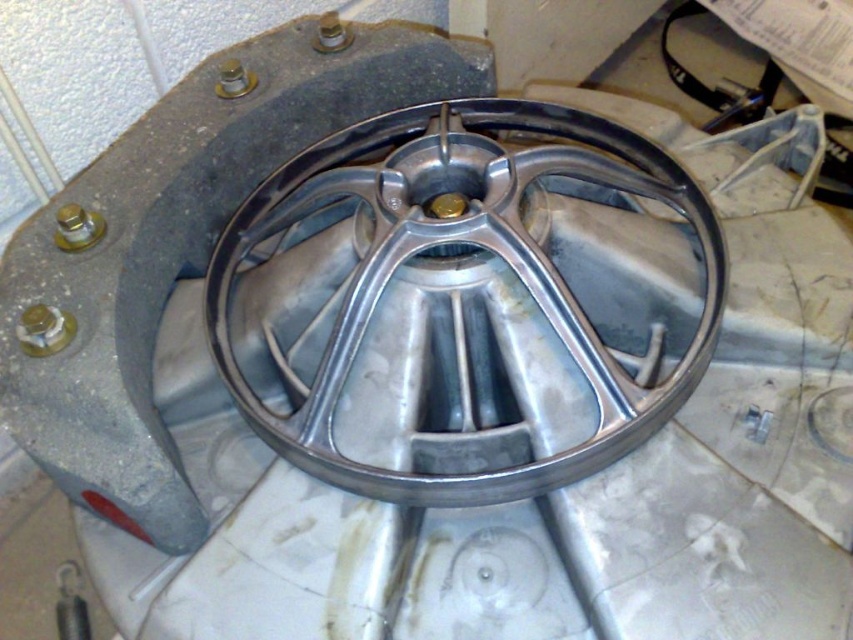
Question: Among these objects, which one is farthest from the camera?

Choices:
 (A) matte silver bolt at upper left
 (B) polished silver rim at center
 (C) matte gold bolt at upper left
 (D) gold metallic bolt at center

Answer: (C)

Question: Estimate the real-world distances between objects in this image. Which object is closer to the matte silver bolt at upper left?

Choices:
 (A) matte gold bolt at upper left
 (B) gold metallic bolt at center
 (C) polished silver rim at center

Answer: (A)

Question: Can you confirm if matte silver bolt at upper left is wider than gold metallic bolt at center?

Choices:
 (A) yes
 (B) no

Answer: (A)

Question: Does matte silver bolt at upper left have a greater width compared to matte gold bolt at upper left?

Choices:
 (A) no
 (B) yes

Answer: (B)

Question: Is matte silver bolt at upper left behind gold metallic bolt at center?

Choices:
 (A) yes
 (B) no

Answer: (B)

Question: Which of these objects is positioned closest to the matte silver bolt at upper left?

Choices:
 (A) gold metallic bolt at center
 (B) matte gold bolt at upper left

Answer: (B)